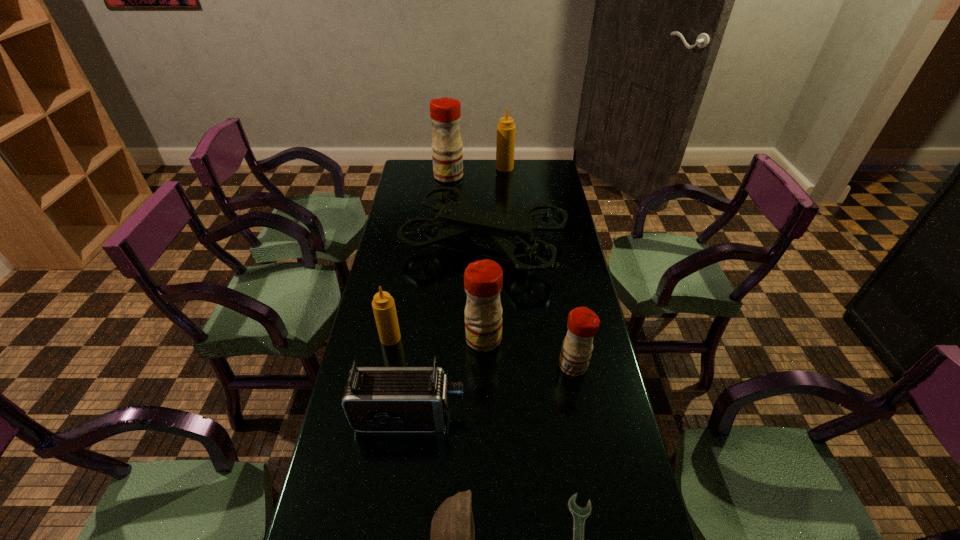
This screenshot has height=540, width=960. Identify the location of the fourth condiment from right to left. (445, 113).

The height and width of the screenshot is (540, 960). Identify the location of the farthest red condiment. (445, 113).

The height and width of the screenshot is (540, 960). Identify the location of drone. (509, 231).

I want to click on the bigger tan condiment, so click(505, 145).

Locate an element on the screen. The height and width of the screenshot is (540, 960). the fourth condiment from left to right is located at coordinates (505, 145).

I want to click on the second nearest red condiment, so click(483, 279).

Find the location of a particular element. The height and width of the screenshot is (540, 960). the second biggest red condiment is located at coordinates (483, 279).

At what (x,y) coordinates should I click in order to perform the action: click on the left tan condiment. Please return your answer as a coordinate pair (x, y). Looking at the image, I should click on (383, 304).

This screenshot has height=540, width=960. Identify the location of the nearer tan condiment. (383, 304).

Locate an element on the screen. the nearest condiment is located at coordinates (583, 323).